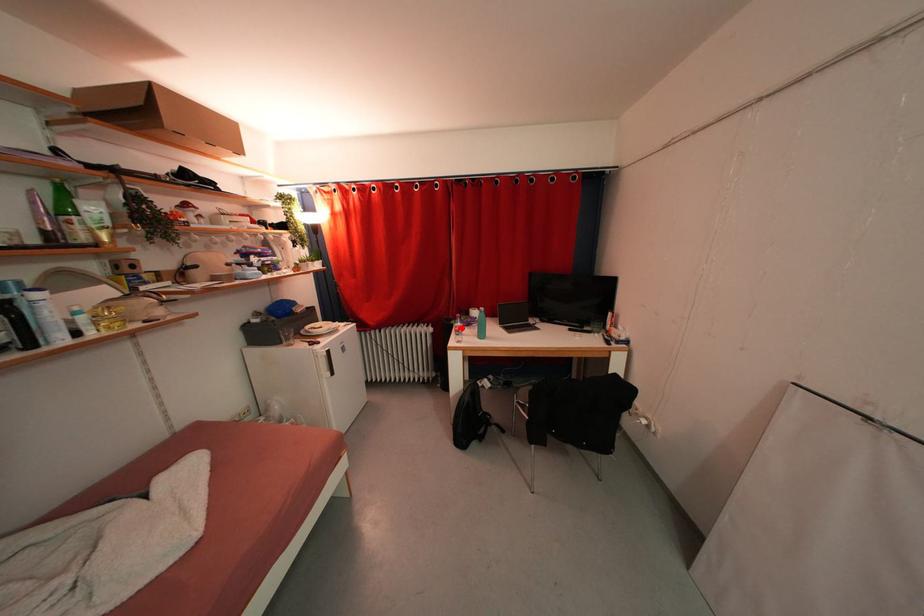
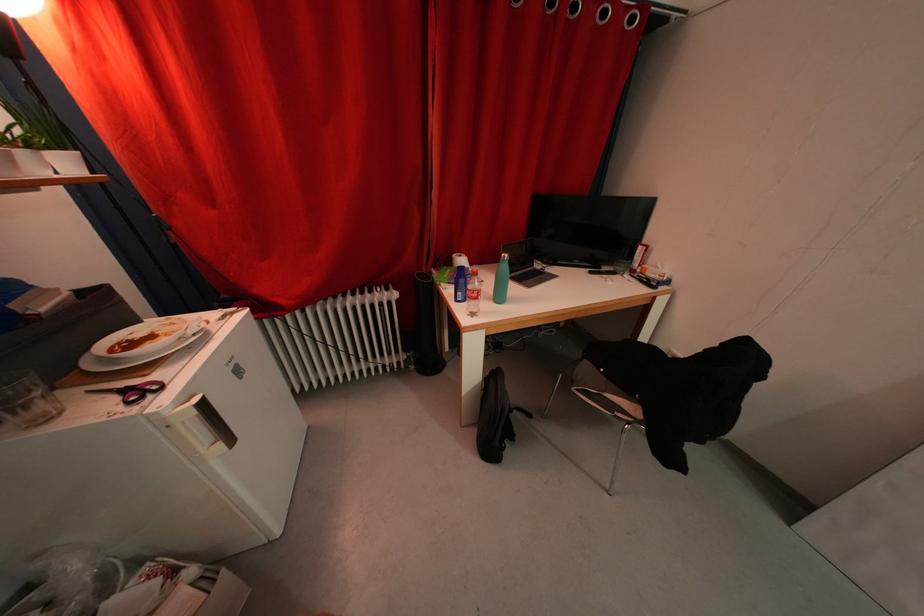
In the second image, find the point that corresponds to the highlighted location in the first image.

(476, 291)